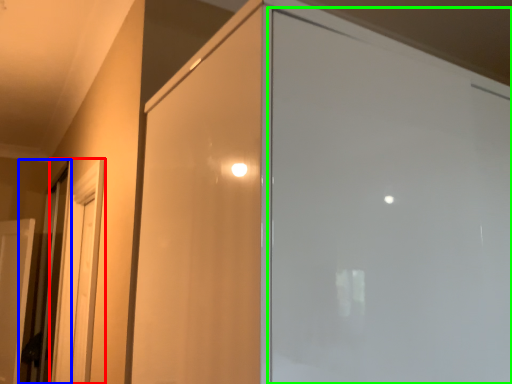
Question: Which is nearer to the screen door (highlighted by a red box)? elevator (highlighted by a blue box) or screen door (highlighted by a green box).

Choices:
 (A) elevator
 (B) screen door

Answer: (A)